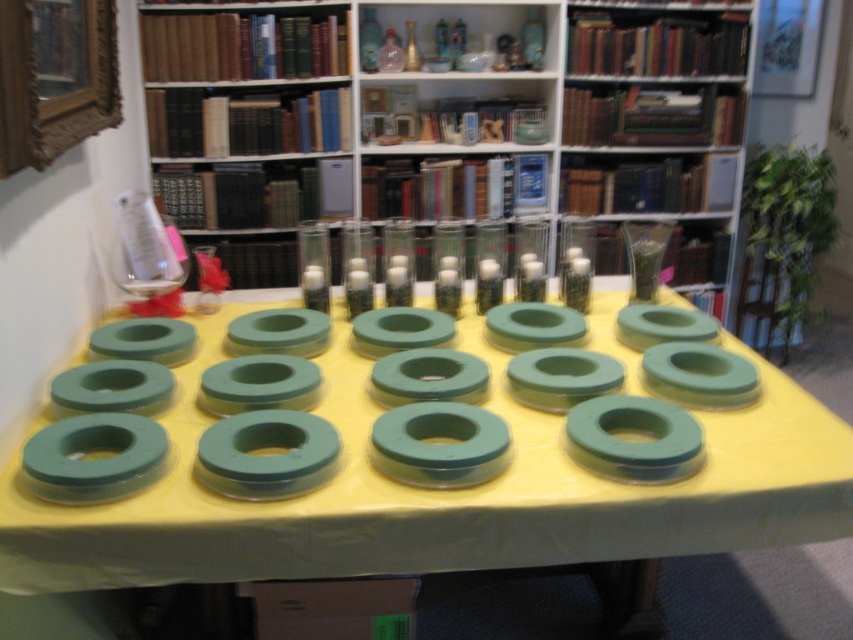
Question: Can you confirm if wooden bookshelf at upper center is positioned to the right of green rubber rings at center?

Choices:
 (A) no
 (B) yes

Answer: (B)

Question: Where is wooden bookshelf at upper center located in relation to green rubber rings at center in the image?

Choices:
 (A) left
 (B) right

Answer: (B)

Question: Is wooden bookshelf at upper center to the left of green rubber rings at center from the viewer's perspective?

Choices:
 (A) yes
 (B) no

Answer: (B)

Question: Which of the following is the farthest from the observer?

Choices:
 (A) wooden bookshelf at upper center
 (B) green rubber rings at center

Answer: (A)